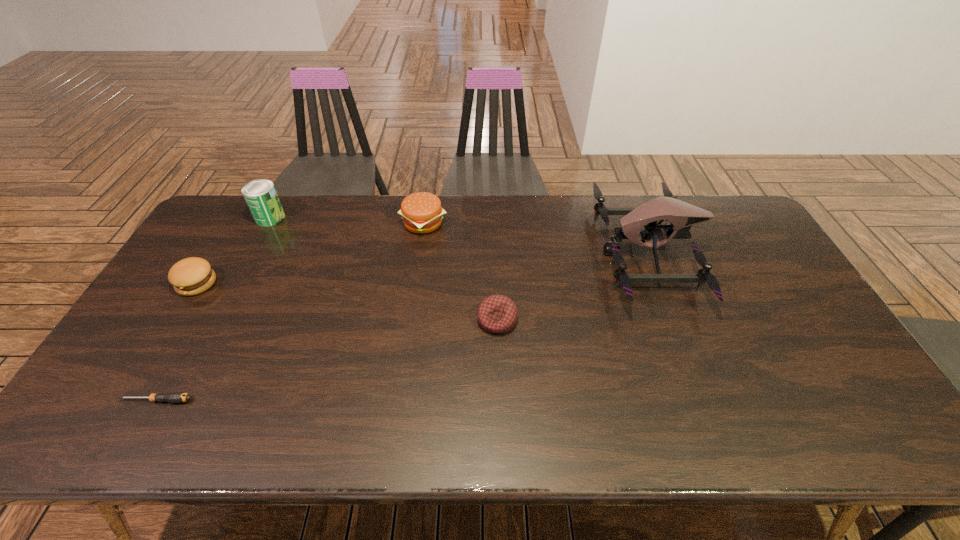
Find the location of a particular element. vacant region located on the front-facing side of the drone is located at coordinates (505, 253).

Image resolution: width=960 pixels, height=540 pixels. I want to click on blank space located on the front-facing side of the drone, so click(490, 253).

I want to click on free space located 0.320m on the front-facing side of the drone, so click(499, 253).

This screenshot has width=960, height=540. I want to click on vacant region located 0.070m on the back of the can, so click(x=280, y=197).

You are a GUI agent. You are given a task and a screenshot of the screen. Output one action in this format:
    pyautogui.click(x=<x>, y=<y>)
    Task: Click on the blank space located on the left of the fourth object from left to right
    The height and width of the screenshot is (540, 960).
    Given the screenshot: What is the action you would take?
    pyautogui.click(x=305, y=223)

The height and width of the screenshot is (540, 960). Identify the location of vacant area located 0.070m on the front of the left hamburger. [x=177, y=317].

I want to click on free space located on the left of the second object from right to left, so click(x=426, y=320).

The image size is (960, 540). I want to click on free space located 0.090m on the right of the shortest object, so click(229, 400).

This screenshot has height=540, width=960. I want to click on drone at the far edge, so click(x=681, y=215).

The image size is (960, 540). I want to click on can at the far edge, so click(x=261, y=197).